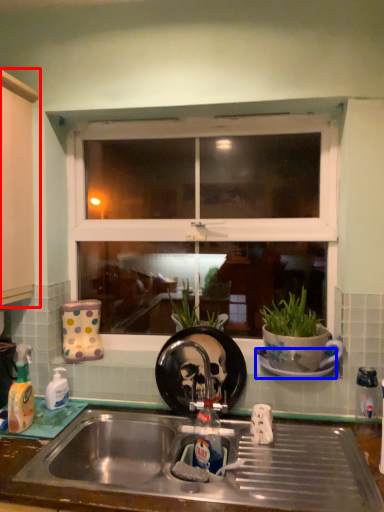
Question: Among these objects, which one is farthest to the camera, cabinetry (highlighted by a red box) or saucer (highlighted by a blue box)?

Choices:
 (A) cabinetry
 (B) saucer

Answer: (B)